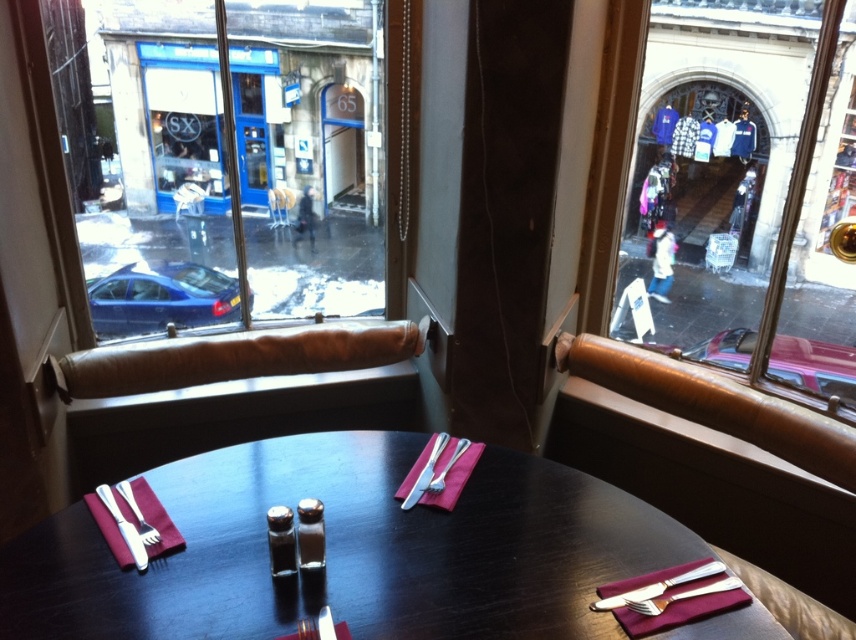
Question: Which object appears farthest from the camera in this image?

Choices:
 (A) maroon fabric at lower left
 (B) shiny dark wood table at center
 (C) gold plated fork and knife at lower right

Answer: (A)

Question: Is transparent glass window at center further to camera compared to silver/golden metal fork at lower right?

Choices:
 (A) no
 (B) yes

Answer: (B)

Question: Which object is the farthest from the transparent glass window at center?

Choices:
 (A) glass window at upper right
 (B) shiny dark wood table at center

Answer: (A)

Question: Can you confirm if gold plated fork and knife at lower right is positioned to the right of silvermetallicfork and knife at center?

Choices:
 (A) yes
 (B) no

Answer: (A)

Question: Which point is closer to the camera?

Choices:
 (A) (710, 563)
 (B) (52, 77)

Answer: (A)

Question: Does silvermetallicfork and knife at center have a lesser width compared to silver/golden metal fork at lower right?

Choices:
 (A) no
 (B) yes

Answer: (B)